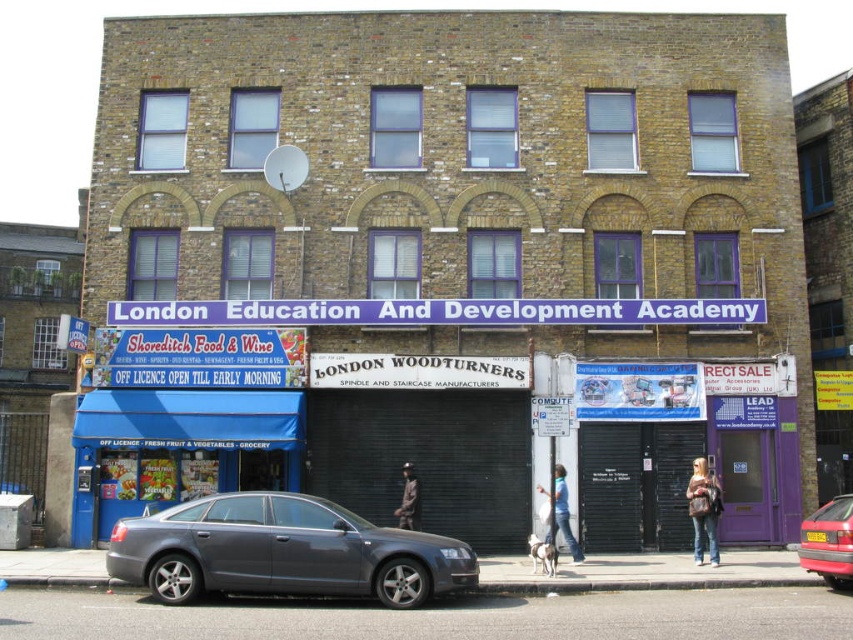
You are a delivery person trying to park your 2.5 meter wide van in front of the Shoreditch Food and Wine shop. The red metallic car at center is currently blocking the space. If you move the car out, will there be enough space for your van since the blue jeans at lower center is occupying part of the area?

The red metallic car at center is narrower than the blue jeans at lower center. Since the van is 2.5 meters wide, and the available space after moving the car would depend on the width of the blue jeans at lower center, but since the blue jeans at lower center is wider than the car, there might not be enough space for the van.

You are standing in front of the Shoreditch Food and Wine shop and see a denim jacket at lower right and blue jeans at lower center. Which item is positioned lower in the image?

The denim jacket at lower right is located below blue jeans at lower center, so the denim jacket at lower right is positioned lower in the image.

You are a delivery person who needs to place a package between the denim jacket at lower right and the blue jeans at lower center. The package requires 3 meters of space. Can you fit it there?

The denim jacket at lower right and blue jeans at lower center are 3.41 meters apart from each other, so yes, the package requiring 3 meters of space can fit between them since the distance is sufficient.